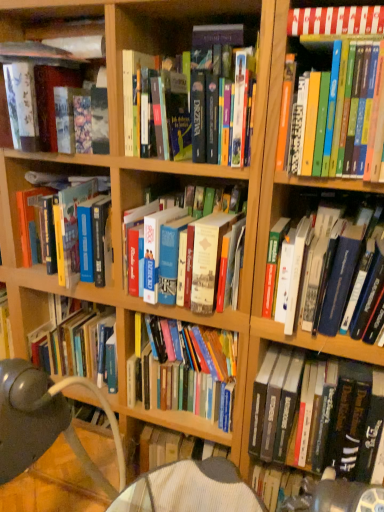
Where is `hardcover books at upper right, acting as the sixth book starting from the bottom`? This screenshot has width=384, height=512. hardcover books at upper right, acting as the sixth book starting from the bottom is located at coordinates (310, 124).

What do you see at coordinates (187, 372) in the screenshot? This screenshot has height=512, width=384. I see `hardcover book at center, which is the eighth book in top-to-bottom order` at bounding box center [187, 372].

How much space does white paper book at upper right, positioned as the 1th book in top-to-bottom order, occupy horizontally?

It is 32.32 centimeters.

Where is `hardcover books at upper right, acting as the fourth book starting from the top`? hardcover books at upper right, acting as the fourth book starting from the top is located at coordinates (310, 124).

Is hardcover books at center, which ranks as the fourth book in bottom-to-top order, in front of or behind hardcover book at center, which is the seventh book in top-to-bottom order, in the image?

Clearly, hardcover books at center, which ranks as the fourth book in bottom-to-top order, is behind hardcover book at center, which is the seventh book in top-to-bottom order.

From a real-world perspective, is hardcover books at center, the 6th book viewed from the top, physically below hardcover book at center, which is the seventh book in top-to-bottom order?

No, from a real-world perspective, hardcover books at center, the 6th book viewed from the top, is not under hardcover book at center, which is the seventh book in top-to-bottom order.

Could you tell me if hardcover books at center, which ranks as the fourth book in bottom-to-top order, is facing hardcover book at center, the third book in the bottom-to-top sequence?

No, hardcover books at center, which ranks as the fourth book in bottom-to-top order, is not oriented towards hardcover book at center, the third book in the bottom-to-top sequence.

From a real-world perspective, which object stands above the other?

white paper book at upper right, positioned as the 1th book in top-to-bottom order, is physically above.

Is white paper book at upper right, positioned as the 1th book in top-to-bottom order, in contact with hardcover book at center, which is the eighth book in top-to-bottom order?

No, white paper book at upper right, positioned as the 1th book in top-to-bottom order, is not beside hardcover book at center, which is the eighth book in top-to-bottom order.

Is white paper book at upper right, positioned as the 1th book in top-to-bottom order, not inside hardcover book at center, which is the eighth book in top-to-bottom order?

white paper book at upper right, positioned as the 1th book in top-to-bottom order, is positioned outside hardcover book at center, which is the eighth book in top-to-bottom order.

Which is closer to the camera, (342, 26) or (69, 275)?

The point (342, 26) is more forward.

Is white paper book at upper right, arranged as the 9th book when ordered from the bottom, positioned with its back to hardcover book at center, arranged as the fifth book when viewed from the top?

No, white paper book at upper right, arranged as the 9th book when ordered from the bottom, is not facing the opposite direction of hardcover book at center, arranged as the fifth book when viewed from the top.

Between white paper book at upper right, positioned as the 1th book in top-to-bottom order, and hardcover book at center, the 5th book when ordered from bottom to top, which one has more height?

hardcover book at center, the 5th book when ordered from bottom to top, is taller.

Is the surface of white paper book at upper right, positioned as the 1th book in top-to-bottom order, in direct contact with hardcover book at center, arranged as the fifth book when viewed from the top?

No, white paper book at upper right, positioned as the 1th book in top-to-bottom order, is not in contact with hardcover book at center, arranged as the fifth book when viewed from the top.

Which book is the 6th one when counting from the front of the hardcover book at center, the 2th book positioned from the bottom? Please provide its 2D coordinates.

[(336, 263)]

Is the position of hardcover book at center, which is the seventh book in top-to-bottom order, more distant than that of hardcover book at center, the 2th book positioned from the bottom?

No, it is not.

Is hardcover book at center, which is the eighth book in top-to-bottom order, at the back of hardcover book at center, which is the seventh book in top-to-bottom order?

That's not correct — hardcover book at center, which is the seventh book in top-to-bottom order, is not looking away from hardcover book at center, which is the eighth book in top-to-bottom order.

Considering the sizes of hardcover books at upper right, acting as the fourth book starting from the top, and hardcover book at center, which is the 9th book in top-to-bottom order, in the image, is hardcover books at upper right, acting as the fourth book starting from the top, bigger or smaller than hardcover book at center, which is the 9th book in top-to-bottom order,?

In the image, hardcover books at upper right, acting as the fourth book starting from the top, appears to be smaller than hardcover book at center, which is the 9th book in top-to-bottom order.

You are a GUI agent. You are given a task and a screenshot of the screen. Output one action in this format:
    pyautogui.click(x=<x>, y=<y>)
    Task: Click on the 2nd book counting from the left side of the hardcover book at center, which is counted as the 1th book, starting from the bottom
    
    Given the screenshot: What is the action you would take?
    pyautogui.click(x=310, y=124)

Based on the photo, from the image's perspective, is hardcover books at upper right, acting as the sixth book starting from the bottom, above or below hardcover book at center, which is the 9th book in top-to-bottom order?

Based on their image positions, hardcover books at upper right, acting as the sixth book starting from the bottom, is located above hardcover book at center, which is the 9th book in top-to-bottom order.

Can you confirm if hardcover books at upper right, acting as the fourth book starting from the top, is positioned to the right of hardcover book at center, which is counted as the 1th book, starting from the bottom?

No, hardcover books at upper right, acting as the fourth book starting from the top, is not to the right of hardcover book at center, which is counted as the 1th book, starting from the bottom.

Considering the points (58, 38) and (209, 360), which point is in front, point (58, 38) or point (209, 360)?

The point (58, 38) is more forward.

Can you see matte black book at upper left, which ranks as the 8th book in bottom-to-top order, touching hardcover book at center, which is the eighth book in top-to-bottom order?

They are not placed beside each other.

Is matte black book at upper left, which ranks as the 8th book in bottom-to-top order, looking in the opposite direction of hardcover book at center, which is the eighth book in top-to-bottom order?

That's not correct — matte black book at upper left, which ranks as the 8th book in bottom-to-top order, is not looking away from hardcover book at center, which is the eighth book in top-to-bottom order.

Is hardcover book at center, the 5th book when ordered from bottom to top, far away from hardcover book at center, which is counted as the 1th book, starting from the bottom?

hardcover book at center, the 5th book when ordered from bottom to top, is near hardcover book at center, which is counted as the 1th book, starting from the bottom, not far away.

Which object is positioned more to the left, hardcover book at center, arranged as the fifth book when viewed from the top, or hardcover book at center, which is counted as the 1th book, starting from the bottom?

From the viewer's perspective, hardcover book at center, arranged as the fifth book when viewed from the top, appears more on the left side.

Measure the distance between hardcover book at center, arranged as the fifth book when viewed from the top, and hardcover book at center, which is counted as the 1th book, starting from the bottom.

The distance of hardcover book at center, arranged as the fifth book when viewed from the top, from hardcover book at center, which is counted as the 1th book, starting from the bottom, is 71.74 centimeters.

From a real-world perspective, which book is the 4th one above the hardcover book at center, which is counted as the 1th book, starting from the bottom? Please provide its 2D coordinates.

[(65, 226)]

From the image's perspective, starting from the hardcover book at center, the third book in the bottom-to-top sequence, which book is the 1st one above? Please provide its 2D coordinates.

[(151, 238)]

From the hardcover book at center, which is the eighth book in top-to-bottom order, count 7th books forward and point to it. Please provide its 2D coordinates.

[(336, 20)]

Based on their spatial positions, is matte black book at upper left, which ranks as the 8th book in bottom-to-top order, or white paper book at upper right, positioned as the 1th book in top-to-bottom order, further from hardcover books at center, the 6th book viewed from the top?

white paper book at upper right, positioned as the 1th book in top-to-bottom order, lies further to hardcover books at center, the 6th book viewed from the top, than the other object.

Which object lies nearer to the anchor point hardcover book at center, which is the seventh book in top-to-bottom order, hardcover book at center, which is the eighth book in top-to-bottom order, or hardcover book at center, marked as the seventh book in a bottom-to-top arrangement?

Among the two, hardcover book at center, which is the eighth book in top-to-bottom order, is located nearer to hardcover book at center, which is the seventh book in top-to-bottom order.

Based on their spatial positions, is hardcover book at center, arranged as the fifth book when viewed from the top, or hardcover book at center, which is the seventh book in top-to-bottom order, closer to hardcover book at center, marked as the seventh book in a bottom-to-top arrangement?

hardcover book at center, arranged as the fifth book when viewed from the top, is closer to hardcover book at center, marked as the seventh book in a bottom-to-top arrangement.

From the image, which object appears to be nearer to hardcover books at upper right, acting as the sixth book starting from the bottom, hardcover book at center, the third book in the bottom-to-top sequence, or hardcover books at center, the 6th book viewed from the top?

hardcover book at center, the third book in the bottom-to-top sequence, lies closer to hardcover books at upper right, acting as the sixth book starting from the bottom, than the other object.

From the image, which object appears to be farther from hardcover books at upper right, acting as the sixth book starting from the bottom, hardcover books at center, the 6th book viewed from the top, or hardcover book at center, arranged as the fifth book when viewed from the top?

hardcover book at center, arranged as the fifth book when viewed from the top, is positioned further to the anchor hardcover books at upper right, acting as the sixth book starting from the bottom.

Based on their spatial positions, is white paper book at upper right, arranged as the 9th book when ordered from the bottom, or matte black book at upper left, which is counted as the 2th book, starting from the top, further from hardcover books at center, the 6th book viewed from the top?

The object further to hardcover books at center, the 6th book viewed from the top, is white paper book at upper right, arranged as the 9th book when ordered from the bottom.

In the scene shown: Considering their positions, is hardcover books at upper right, acting as the sixth book starting from the bottom, positioned closer to hardcover book at center, marked as the seventh book in a bottom-to-top arrangement, than white paper book at upper right, positioned as the 1th book in top-to-bottom order?

hardcover books at upper right, acting as the sixth book starting from the bottom, lies closer to hardcover book at center, marked as the seventh book in a bottom-to-top arrangement, than the other object.

Considering their positions, is hardcover books at center, which ranks as the fourth book in bottom-to-top order, positioned further to white paper book at upper right, positioned as the 1th book in top-to-bottom order, than hardcover books at upper right, acting as the sixth book starting from the bottom?

Based on the image, hardcover books at center, which ranks as the fourth book in bottom-to-top order, appears to be further to white paper book at upper right, positioned as the 1th book in top-to-bottom order.

I want to click on book between hardcover book at center, marked as the seventh book in a bottom-to-top arrangement, and hardcover books at upper right, acting as the sixth book starting from the bottom, in the horizontal direction, so click(x=336, y=20).